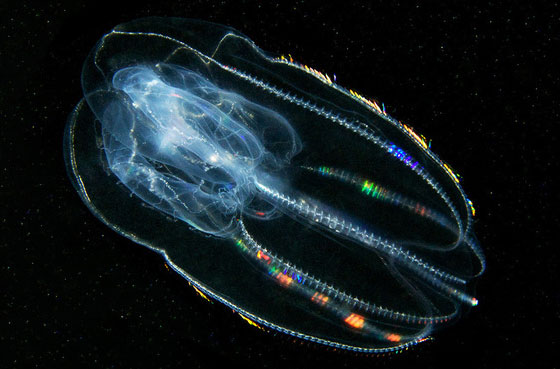
Find the location of a particular element. This screenshot has width=560, height=369. yellow light is located at coordinates (197, 286), (240, 322), (474, 208), (452, 176), (414, 140), (371, 106), (310, 72).